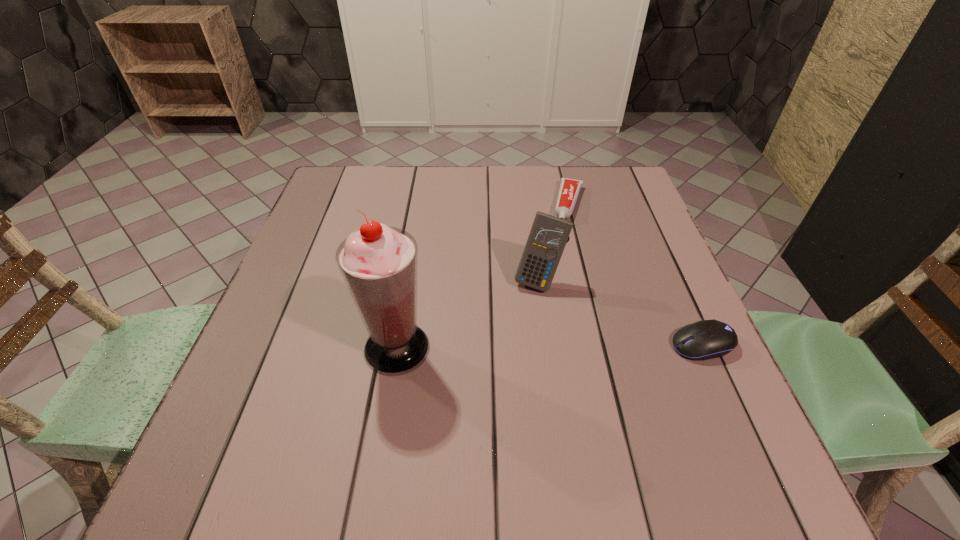
Locate an element on the screen. vacant space located at the nozzle of the farthest object is located at coordinates (565, 241).

Identify the location of free space located 0.080m at the nozzle of the farthest object. This screenshot has height=540, width=960. (564, 244).

This screenshot has width=960, height=540. Identify the location of vacant space situated on the front-facing side of the third shortest object. (478, 410).

At what (x,y) coordinates should I click in order to perform the action: click on vacant space located on the front-facing side of the third shortest object. Please return your answer as a coordinate pair (x, y). The width and height of the screenshot is (960, 540). Looking at the image, I should click on (476, 415).

At what (x,y) coordinates should I click in order to perform the action: click on free point located on the front-facing side of the third shortest object. Please return your answer as a coordinate pair (x, y). This screenshot has height=540, width=960. Looking at the image, I should click on (485, 396).

The width and height of the screenshot is (960, 540). What are the coordinates of `object that is at the far edge` in the screenshot? It's located at (569, 190).

At what (x,y) coordinates should I click in order to perform the action: click on computer mouse situated at the right edge. Please return your answer as a coordinate pair (x, y). Looking at the image, I should click on (707, 339).

Where is `toothpaste that is at the right edge`? Image resolution: width=960 pixels, height=540 pixels. toothpaste that is at the right edge is located at coordinates (569, 190).

Locate an element on the screen. The width and height of the screenshot is (960, 540). object located in the far right corner section of the desktop is located at coordinates (569, 190).

In the image, there is a desktop. Identify the location of free space at the far edge. (421, 174).